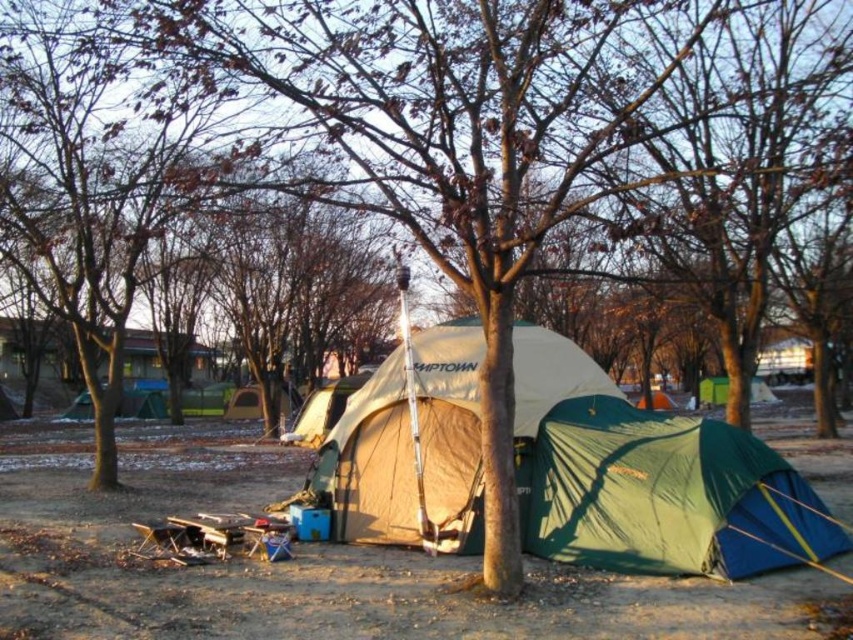
Is green fabric tent at lower right above beige fabric tent at center?

Incorrect, green fabric tent at lower right is not positioned above beige fabric tent at center.

Is green fabric tent at lower right taller than beige fabric tent at center?

No.

This screenshot has width=853, height=640. What do you see at coordinates (668, 496) in the screenshot?
I see `green fabric tent at lower right` at bounding box center [668, 496].

I want to click on green fabric tent at lower right, so click(668, 496).